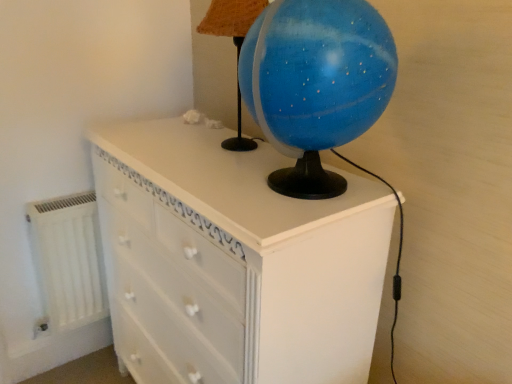
Question: From their relative heights in the image, would you say white painted wood chest of drawers at center is taller or shorter than white matte radiator at lower left?

Choices:
 (A) tall
 (B) short

Answer: (A)

Question: In the image, is white painted wood chest of drawers at center positioned in front of or behind white matte radiator at lower left?

Choices:
 (A) behind
 (B) front

Answer: (B)

Question: Estimate the real-world distances between objects in this image. Which object is farther from the blue glossy globe at upper center?

Choices:
 (A) white matte radiator at lower left
 (B) white painted wood chest of drawers at center

Answer: (A)

Question: Considering the real-world distances, which object is farthest from the blue glossy globe at upper center?

Choices:
 (A) white matte radiator at lower left
 (B) white painted wood chest of drawers at center

Answer: (A)